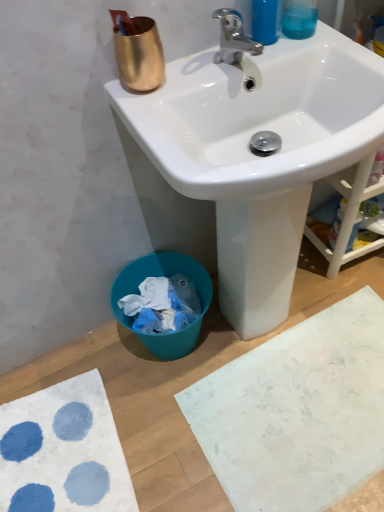
Identify the location of vacant area that lies to the right of white textured bath mat at lower left, positioned as the second bath mat in right-to-left order. (154, 441).